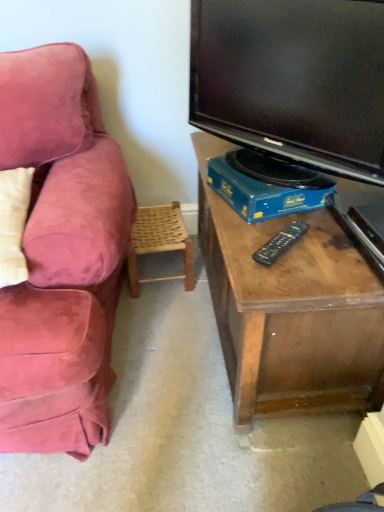
Question: Is black glossy tv at upper right to the left of woven wood chair at lower center from the viewer's perspective?

Choices:
 (A) no
 (B) yes

Answer: (A)

Question: Does black glossy tv at upper right have a larger size compared to woven wood chair at lower center?

Choices:
 (A) yes
 (B) no

Answer: (A)

Question: Is black glossy tv at upper right aimed at woven wood chair at lower center?

Choices:
 (A) yes
 (B) no

Answer: (B)

Question: Is black glossy tv at upper right shorter than woven wood chair at lower center?

Choices:
 (A) no
 (B) yes

Answer: (A)

Question: Considering the relative sizes of black glossy tv at upper right and woven wood chair at lower center in the image provided, is black glossy tv at upper right smaller than woven wood chair at lower center?

Choices:
 (A) yes
 (B) no

Answer: (B)

Question: Can you confirm if black glossy tv at upper right is taller than woven wood chair at lower center?

Choices:
 (A) no
 (B) yes

Answer: (B)

Question: Is black plastic remote at center aimed at blue cardboard box at lower center?

Choices:
 (A) no
 (B) yes

Answer: (A)

Question: Is black plastic remote at center located outside blue cardboard box at lower center?

Choices:
 (A) no
 (B) yes

Answer: (B)

Question: Is black plastic remote at center thinner than blue cardboard box at lower center?

Choices:
 (A) no
 (B) yes

Answer: (B)

Question: Is blue cardboard box at lower center at the back of black plastic remote at center?

Choices:
 (A) yes
 (B) no

Answer: (A)

Question: Is the position of black plastic remote at center less distant than that of blue cardboard box at lower center?

Choices:
 (A) no
 (B) yes

Answer: (B)

Question: Can you confirm if black plastic remote at center is smaller than blue cardboard box at lower center?

Choices:
 (A) yes
 (B) no

Answer: (A)

Question: Is woven wood chair at lower center not near black plastic remote at center?

Choices:
 (A) no
 (B) yes

Answer: (A)